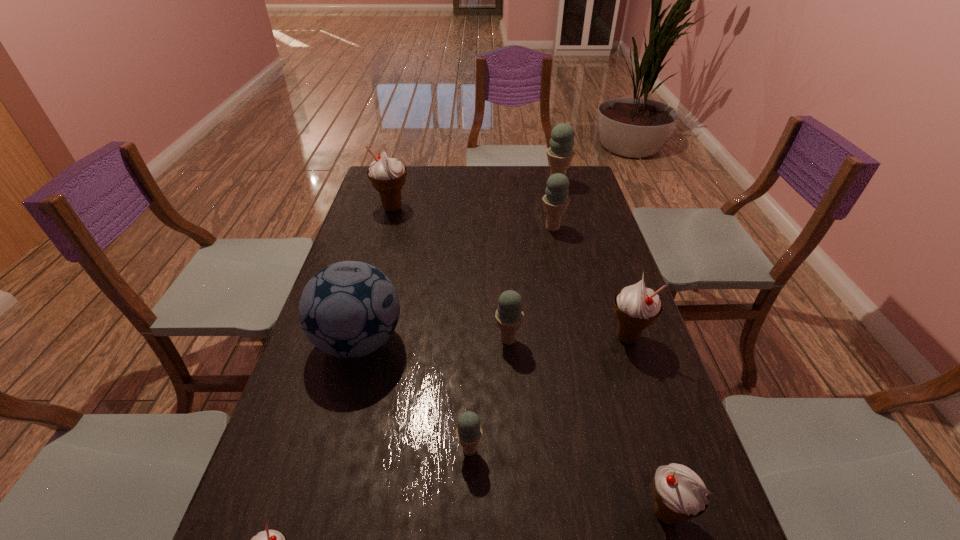
Locate an element on the screen. vacant space that satisfies the following two spatial constraints: 1. on the front side of the third biggest white icecream; 2. on the left side of the third smallest blue ice cream is located at coordinates (614, 514).

In order to click on free spot that satisfies the following two spatial constraints: 1. on the front side of the farthest blue ice cream; 2. on the right side of the third biggest white icecream in this screenshot , I will do `click(643, 514)`.

Identify the location of free region that satisfies the following two spatial constraints: 1. on the side with brand of the second nearest white icecream; 2. on the right side of the soccer ball. The height and width of the screenshot is (540, 960). (313, 514).